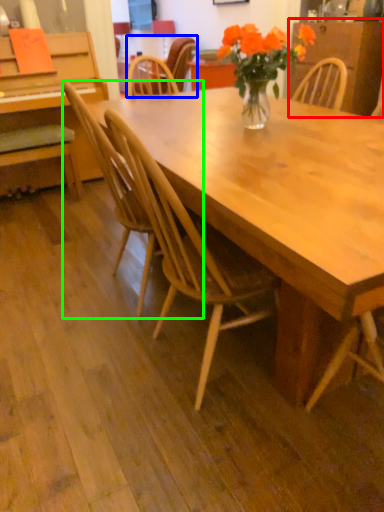
Question: Which object is the closest to the dresser (highlighted by a red box)? Choose among these: chair (highlighted by a blue box) or chair (highlighted by a green box).

Choices:
 (A) chair
 (B) chair

Answer: (A)